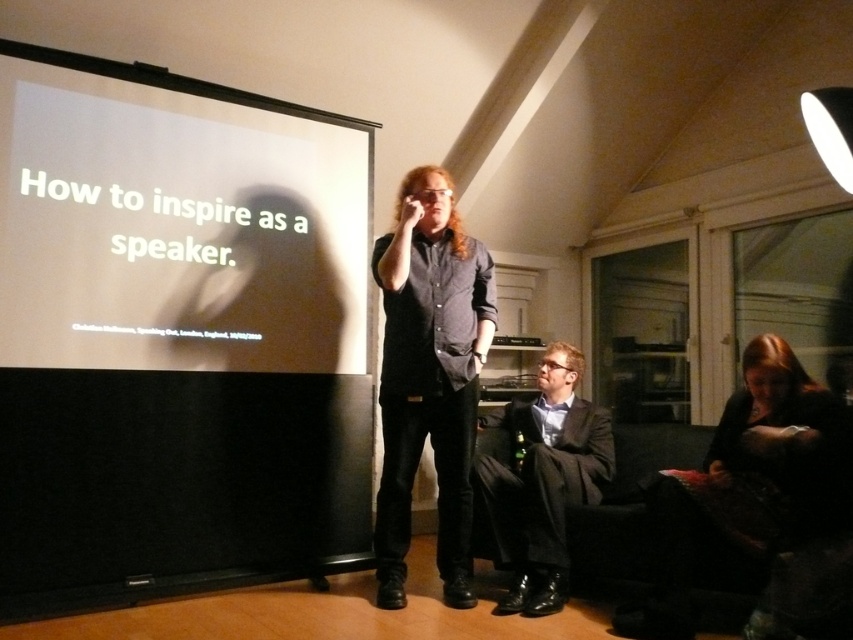
You are organizing a small conference and need to decide where to place a new speaker. The speaker is 1.2 meters wide. The room has a white matte projection screen at upper left and a dark gray shirt at center. Can the speaker fit horizontally between these two objects?

The white matte projection screen at upper left is wider than the dark gray shirt at center. However, since the speaker is 1.2 meters wide and the exact distance between them isn

You are a speaker preparing to give a presentation. You notice the white matte projection screen at upper left and the dark gray shirt at center. Which object is positioned higher in the image?

The white matte projection screen at upper left is positioned higher than the dark gray shirt at center.